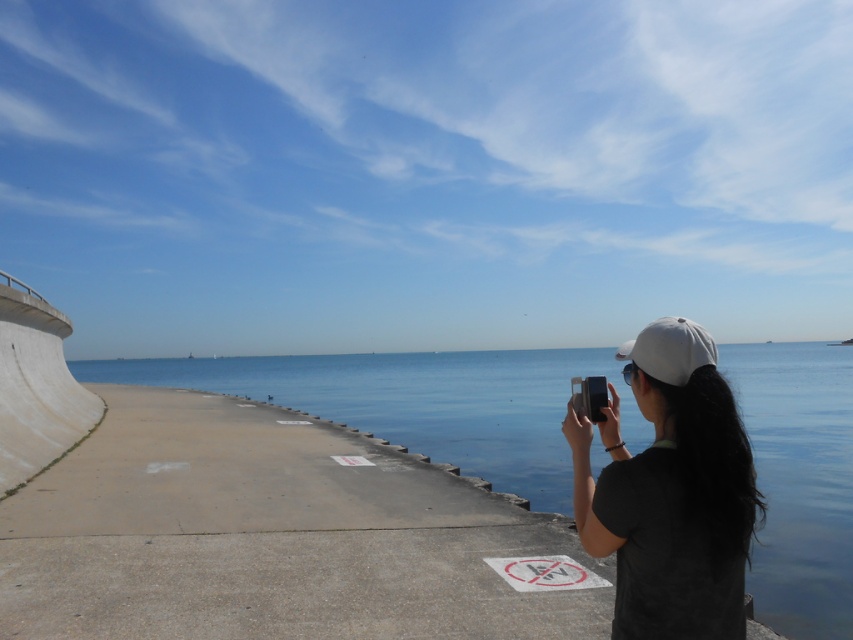
Is point (723, 440) positioned behind point (663, 330)?

No, it is in front of (663, 330).

Locate an element on the screen. black matte cap at upper right is located at coordinates pyautogui.click(x=670, y=492).

Consider the image. Who is more distant from viewer, (643, 429) or (671, 320)?

Positioned behind is point (643, 429).

Is clear blue water at center taller than white matte baseball hat at center?

Indeed, clear blue water at center has a greater height compared to white matte baseball hat at center.

Is point (300, 406) positioned before point (627, 358)?

No.

This screenshot has width=853, height=640. I want to click on clear blue water at center, so click(x=419, y=403).

Locate an element on the screen. clear blue water at center is located at coordinates (419, 403).

Which of these two, clear blue water at center or black matte cap at upper right, stands taller?

clear blue water at center is taller.

The height and width of the screenshot is (640, 853). Identify the location of clear blue water at center. (419, 403).